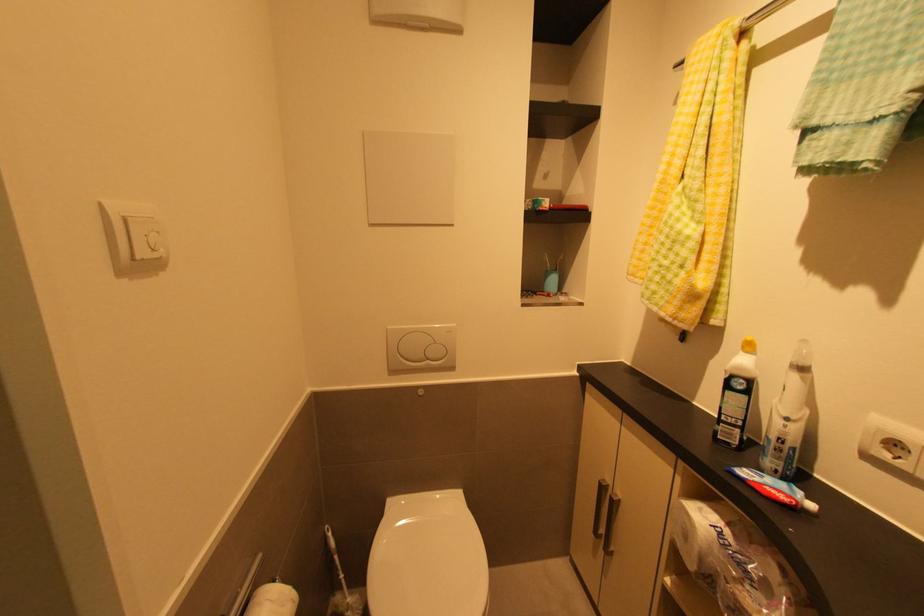
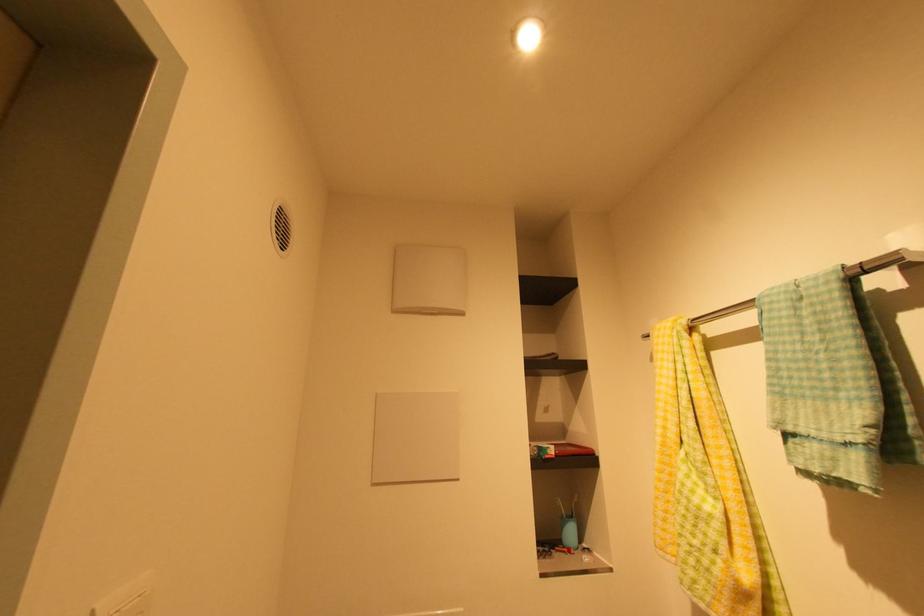
Question: The first image is from the beginning of the video and the second image is from the end. How did the camera likely rotate when shooting the video?

Choices:
 (A) Left
 (B) Right
 (C) Up
 (D) Down

Answer: (C)